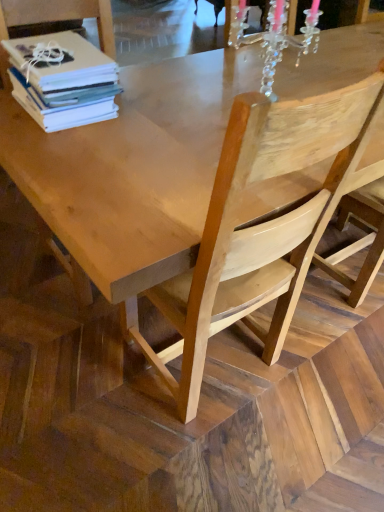
Find the location of a particular element. The width and height of the screenshot is (384, 512). free location in front of white paper stack at upper left is located at coordinates (69, 153).